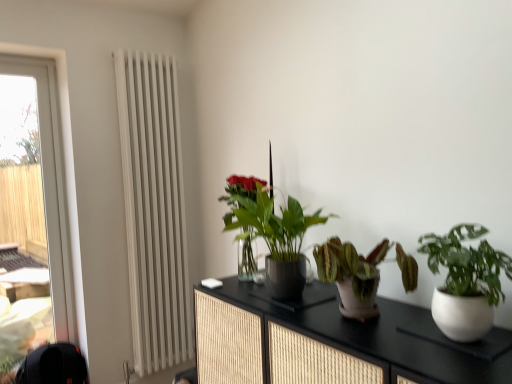
Question: Is transparent glass window at left further to the viewer compared to white matte pot at right, the 4th houseplant viewed from the back?

Choices:
 (A) no
 (B) yes

Answer: (B)

Question: Considering the relative sizes of transparent glass window at left and white matte pot at right, the 4th houseplant viewed from the back, in the image provided, is transparent glass window at left thinner than white matte pot at right, the 4th houseplant viewed from the back,?

Choices:
 (A) yes
 (B) no

Answer: (A)

Question: From the image's perspective, does transparent glass window at left appear higher than white matte pot at right, the 1th houseplant from the front?

Choices:
 (A) yes
 (B) no

Answer: (A)

Question: Is transparent glass window at left located outside white matte pot at right, the 4th houseplant viewed from the back?

Choices:
 (A) no
 (B) yes

Answer: (B)

Question: Can you confirm if transparent glass window at left is positioned to the left of white matte pot at right, the 1th houseplant from the front?

Choices:
 (A) yes
 (B) no

Answer: (A)

Question: Is transparent glass window at left taller than white matte pot at right, the 4th houseplant viewed from the back?

Choices:
 (A) yes
 (B) no

Answer: (A)

Question: Is white metallic radiator at left at the left side of white matte pot at right, the 4th houseplant viewed from the back?

Choices:
 (A) no
 (B) yes

Answer: (B)

Question: From a real-world perspective, is white metallic radiator at left under white matte pot at right, the 1th houseplant from the front?

Choices:
 (A) yes
 (B) no

Answer: (B)

Question: Could white matte pot at right, the 1th houseplant from the front, be considered to be inside white metallic radiator at left?

Choices:
 (A) no
 (B) yes

Answer: (A)

Question: Does white metallic radiator at left have a greater height compared to white matte pot at right, the 4th houseplant viewed from the back?

Choices:
 (A) yes
 (B) no

Answer: (A)

Question: Does white metallic radiator at left have a smaller size compared to white matte pot at right, the 4th houseplant viewed from the back?

Choices:
 (A) no
 (B) yes

Answer: (A)

Question: Is white metallic radiator at left at the right side of white matte pot at right, the 1th houseplant from the front?

Choices:
 (A) yes
 (B) no

Answer: (B)

Question: Considering the relative sizes of black textured cabinet at center and white metallic radiator at left in the image provided, is black textured cabinet at center wider than white metallic radiator at left?

Choices:
 (A) no
 (B) yes

Answer: (B)